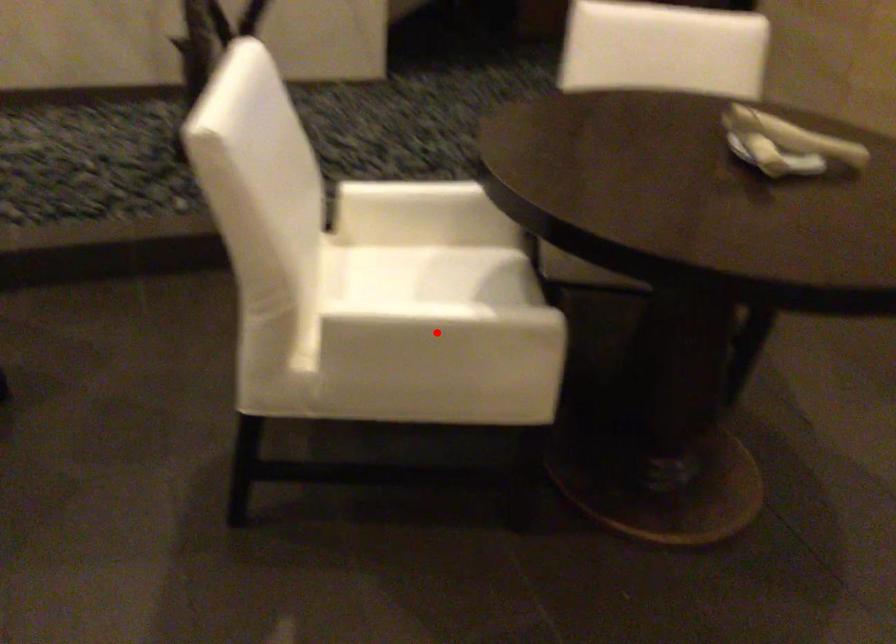
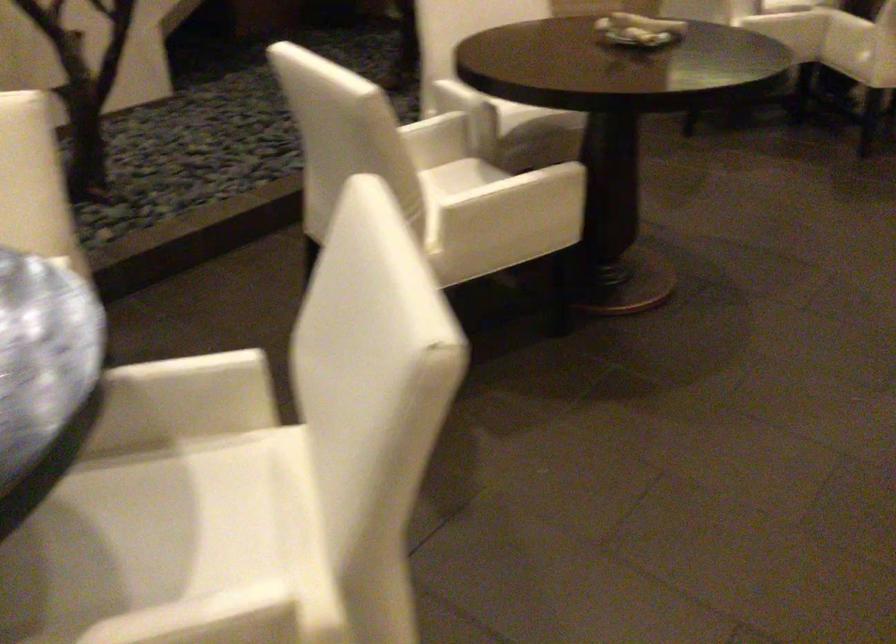
Find the pixel in the second image that matches the highlighted location in the first image.

(513, 196)